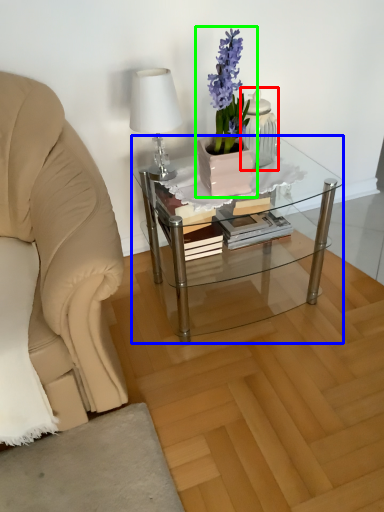
Question: Estimate the real-world distances between objects in this image. Which object is closer to tableware (highlighted by a red box), coffee table (highlighted by a blue box) or houseplant (highlighted by a green box)?

Choices:
 (A) coffee table
 (B) houseplant

Answer: (B)